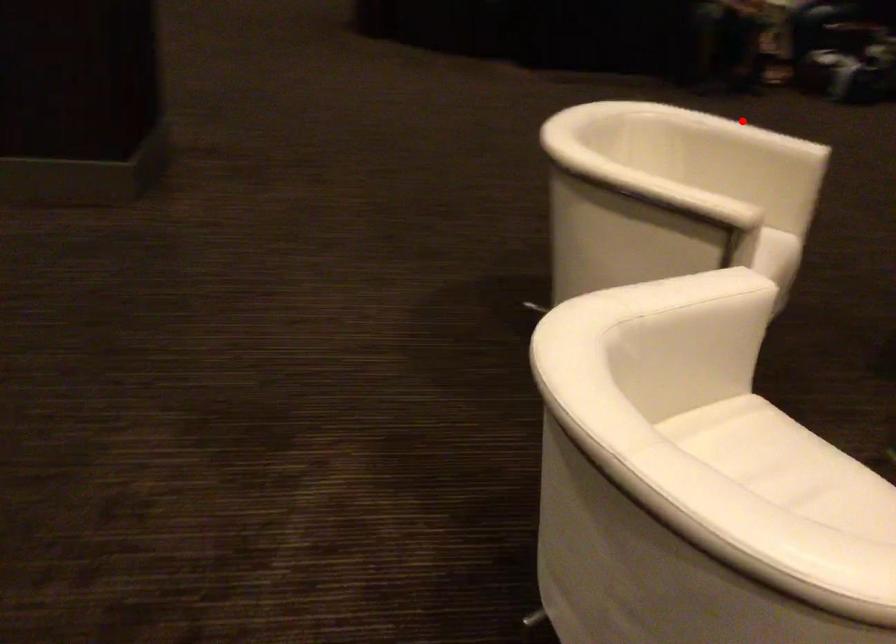
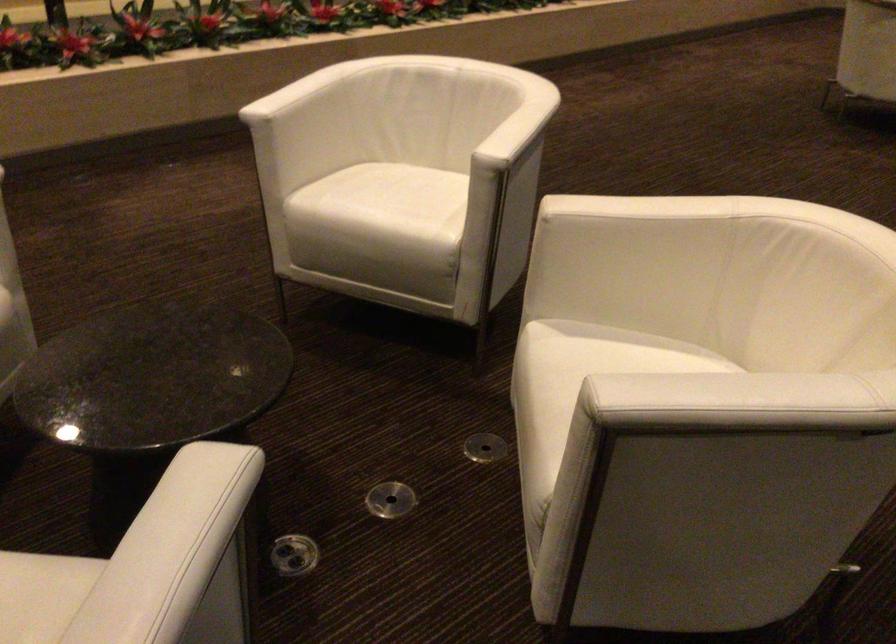
Question: A red point is marked in image1. In image2, is the corresponding 3D point closer to the camera or farther? Reply with the corresponding letter.

Choices:
 (A) The corresponding 3D point is closer.
 (B) The corresponding 3D point is farther.

Answer: (A)